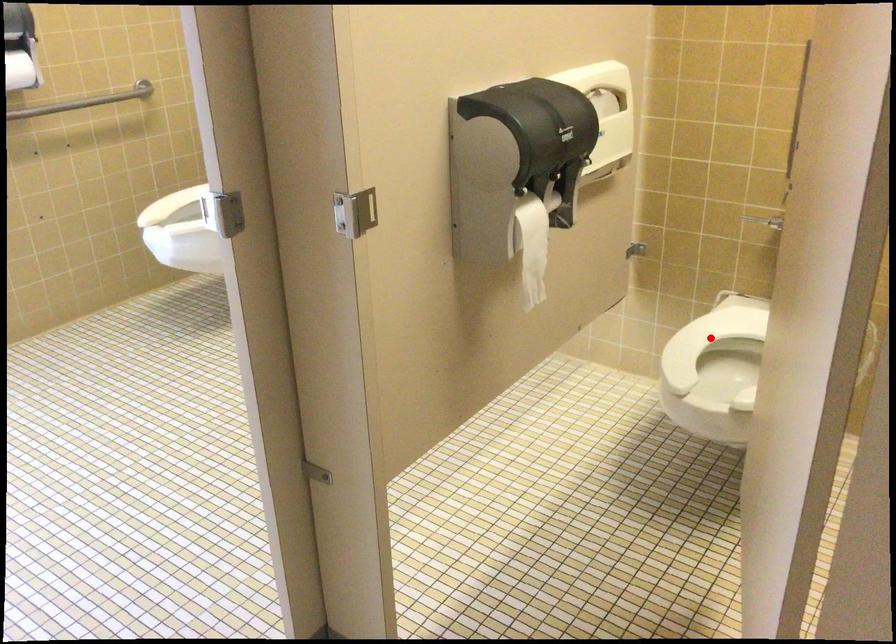
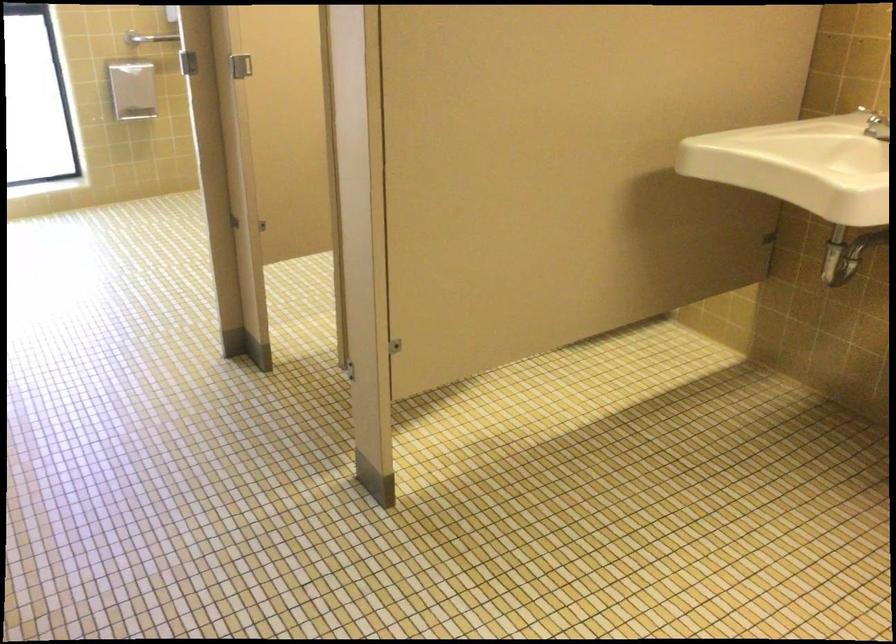
Question: I am providing you with two images of the same scene from different viewpoints. A red point is marked on the first image. Is the red point's position out of view in image 2?

Choices:
 (A) Yes
 (B) No

Answer: (A)